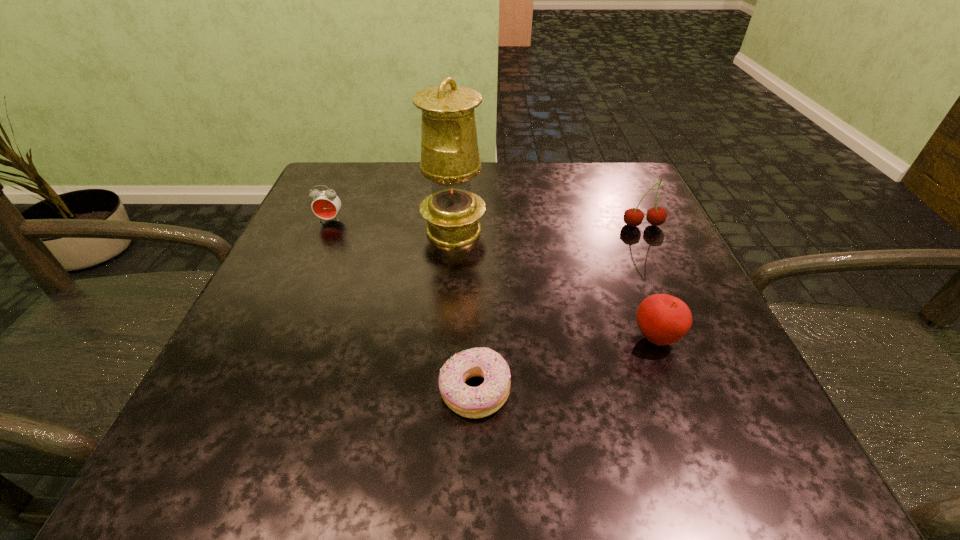
The image size is (960, 540). I want to click on free space in the image that satisfies the following two spatial constraints: 1. on the face of the shortest object; 2. on the right side of the leftmost object, so click(254, 392).